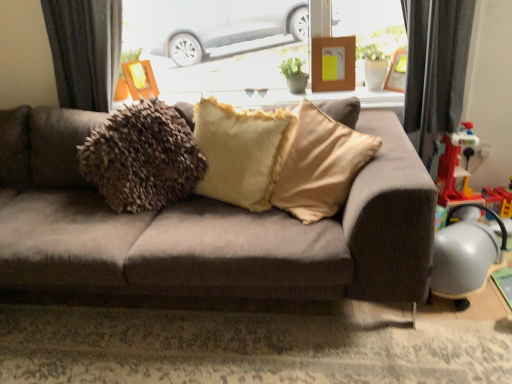
Image resolution: width=512 pixels, height=384 pixels. I want to click on free region on the left part of wooden frame at upper right, positioned as the third picture frame in left-to-right order, so click(x=377, y=90).